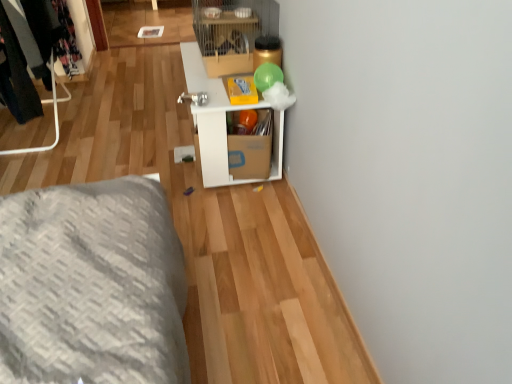
Find the location of a particular element. This screenshot has width=512, height=384. vacant space to the left of white cardboard shelf at center is located at coordinates (148, 144).